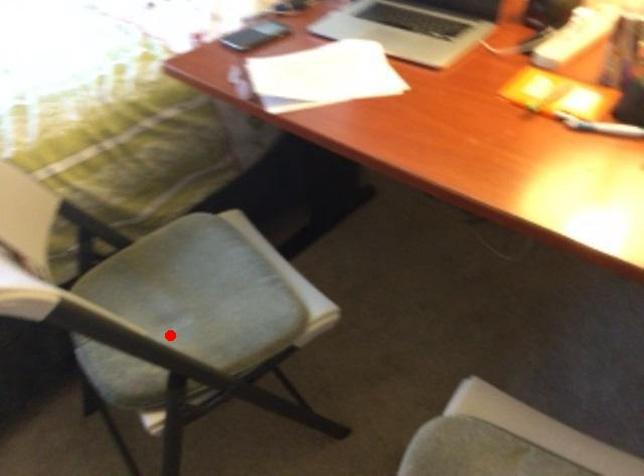
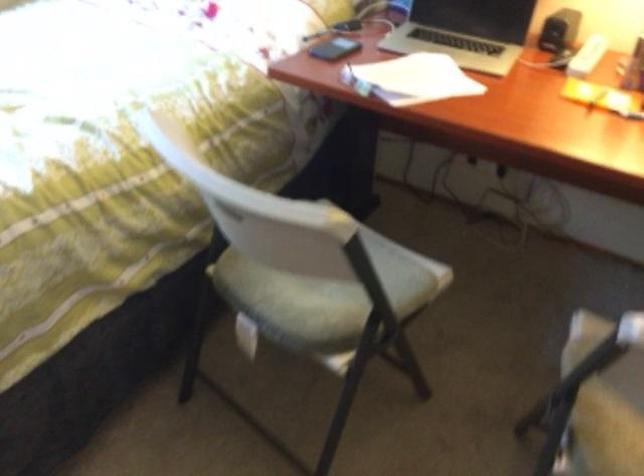
The point at the highlighted location is marked in the first image. Where is the corresponding point in the second image?

(317, 298)